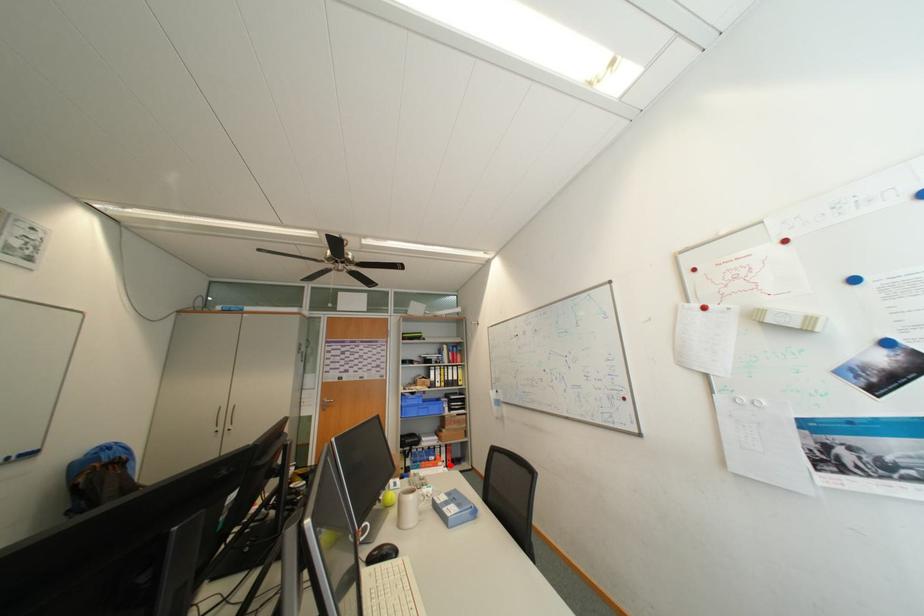
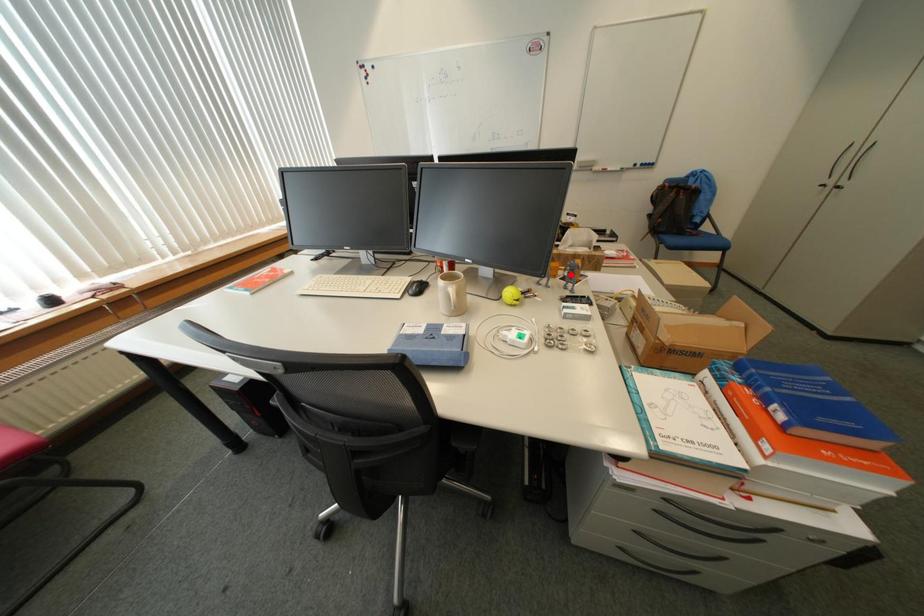
I am providing you with two images of the same scene from different viewpoints. A red point is marked on the first image and another point is marked on the second image. Is the marked point in image1 the same physical position as the marked point in image2?

No